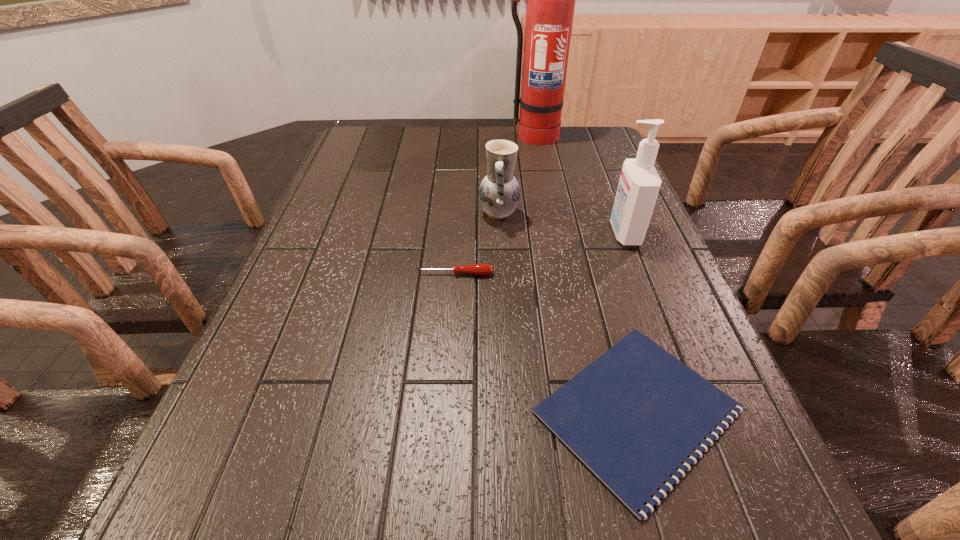
The height and width of the screenshot is (540, 960). Find the location of `vacant space situated 0.360m on the front label of the fourth shortest object`. vacant space situated 0.360m on the front label of the fourth shortest object is located at coordinates (464, 233).

Locate an element on the screen. This screenshot has width=960, height=540. free spot located 0.340m on the front label of the fourth shortest object is located at coordinates (471, 233).

Find the location of `free space located on either side of the pottery`. free space located on either side of the pottery is located at coordinates (460, 213).

I want to click on free space located on either side of the pottery, so click(352, 213).

I want to click on free space located on either side of the pottery, so click(360, 213).

The height and width of the screenshot is (540, 960). In order to click on vacant position located on the front of the screwdriver in this screenshot , I will do `click(447, 393)`.

Where is `vacant space located on the back of the shortest object`? The width and height of the screenshot is (960, 540). vacant space located on the back of the shortest object is located at coordinates (580, 213).

Locate an element on the screen. The height and width of the screenshot is (540, 960). object that is positioned at the far edge is located at coordinates (550, 4).

This screenshot has height=540, width=960. What are the coordinates of `object present at the near edge` in the screenshot? It's located at (632, 416).

The image size is (960, 540). I want to click on cleansing agent that is at the right edge, so click(639, 184).